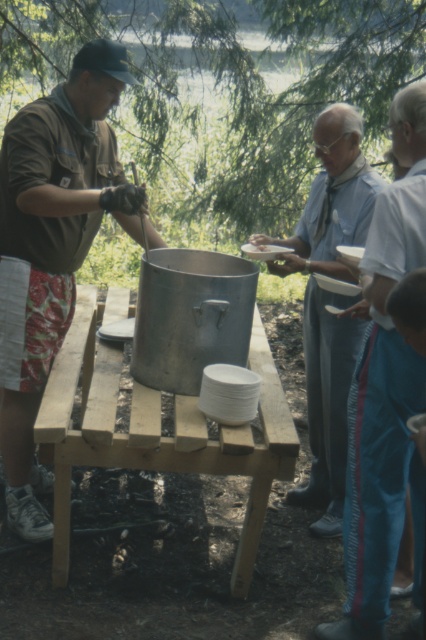
Question: Among these objects, which one is nearest to the camera?

Choices:
 (A) wooden table at center
 (B) blue cotton shirt at center
 (C) brushed metal pot at left

Answer: (A)

Question: Does wooden table at center come in front of blue cotton shirt at center?

Choices:
 (A) yes
 (B) no

Answer: (A)

Question: Does brushed metal pot at left come in front of wooden table at center?

Choices:
 (A) no
 (B) yes

Answer: (A)

Question: From the image, what is the correct spatial relationship of brushed metal pot at left in relation to white matte plate at center?

Choices:
 (A) above
 (B) below

Answer: (B)

Question: Which of these objects is positioned farthest from the wooden table at center?

Choices:
 (A) brushed metal pot at left
 (B) blue track pants at right
 (C) white matte plate at center

Answer: (C)

Question: Among these objects, which one is farthest from the camera?

Choices:
 (A) blue cotton shirt at center
 (B) brushed metal pot at left
 (C) blue track pants at right
 (D) white matte plate at center

Answer: (D)